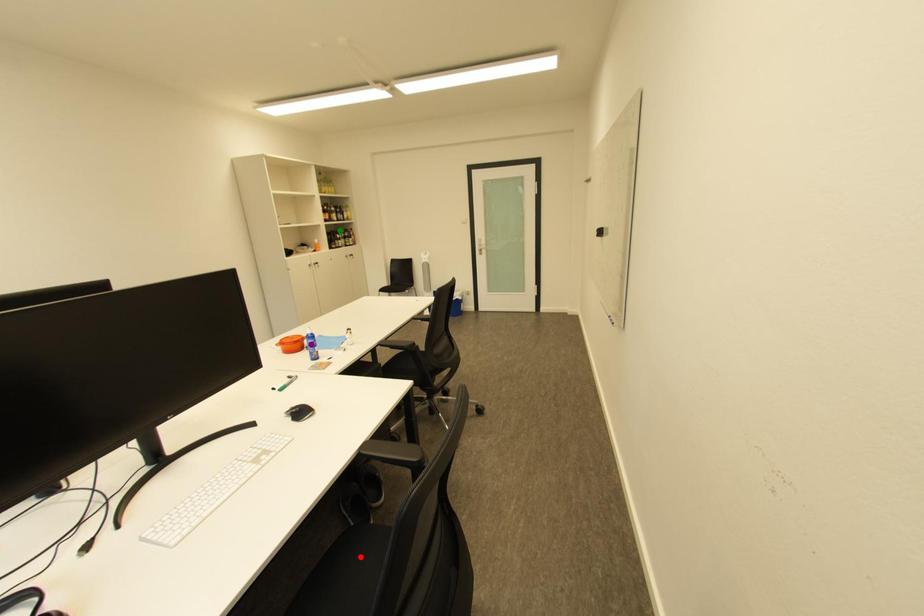
Order these from nearest to farthest:
- green point
- red point
- purple point

1. red point
2. purple point
3. green point